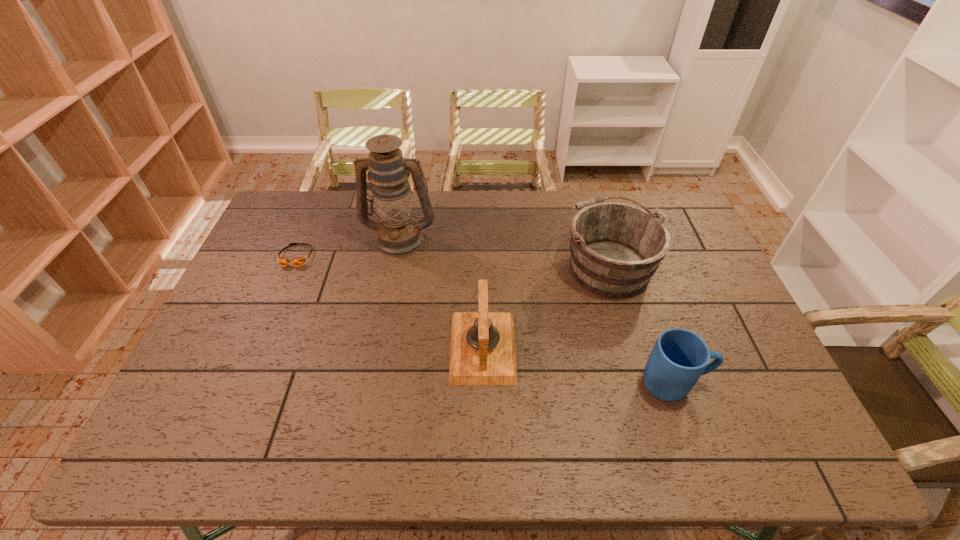
At what (x,y) coordinates should I click in order to perform the action: click on vacant region located 0.050m on the side of the mug with the handle. Please return your answer as a coordinate pair (x, y). Looking at the image, I should click on (726, 384).

At what (x,y) coordinates should I click in order to perform the action: click on free region located 0.210m with the lenses facing forward on the goggles. Please return your answer as a coordinate pair (x, y). Looking at the image, I should click on (270, 320).

Locate an element on the screen. The image size is (960, 540). object positioned at the far edge is located at coordinates (398, 234).

I want to click on object present at the left edge, so click(284, 262).

This screenshot has height=540, width=960. In the image, there is a desktop. Identify the location of vacant space at the far edge. (486, 192).

Where is `free space at the left edge of the desktop`? free space at the left edge of the desktop is located at coordinates (287, 281).

Find the location of a particular element. This screenshot has width=960, height=540. vacant region at the right edge of the desktop is located at coordinates (730, 369).

Identify the location of unoccupied area between the wine bucket and the mug. The height and width of the screenshot is (540, 960). (639, 325).

The height and width of the screenshot is (540, 960). I want to click on empty space that is in between the mug and the wine bucket, so click(639, 325).

At what (x,y) coordinates should I click in order to perform the action: click on vacant space that's between the third object from left to right and the goggles. Please return your answer as a coordinate pair (x, y). The height and width of the screenshot is (540, 960). Looking at the image, I should click on (390, 301).